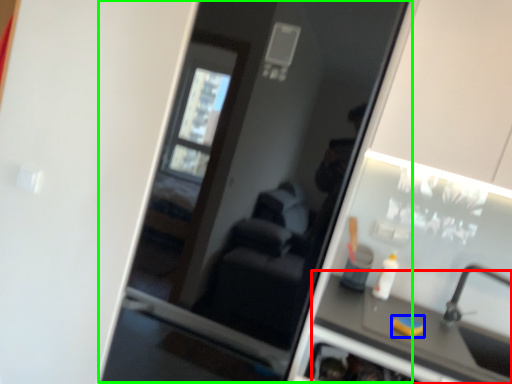
Question: Estimate the real-world distances between objects in this image. Which object is closer to counter top (highlighted by a red box), soap (highlighted by a blue box) or screen door (highlighted by a green box)?

Choices:
 (A) soap
 (B) screen door

Answer: (A)